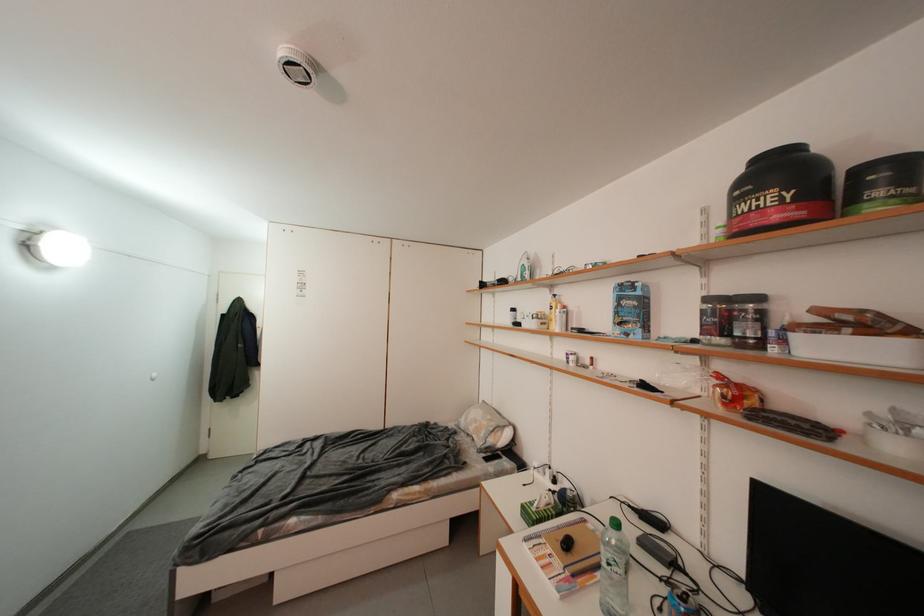
Find where to lift the blue cereal box. Please return your answer as a coordinate pair (x, y).

(630, 310)